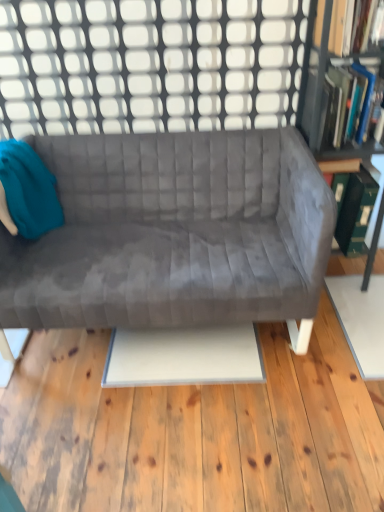
Question: Is the position of hardcover book at upper right, which is counted as the 2th book, starting from the bottom, more distant than that of hardcover book at upper right, which appears as the 1th book when ordered from the bottom?

Choices:
 (A) yes
 (B) no

Answer: (B)

Question: Is the depth of hardcover book at upper right, placed as the 1th book when sorted from top to bottom, less than that of hardcover book at upper right, which is the 2th book from top to bottom?

Choices:
 (A) yes
 (B) no

Answer: (A)

Question: Are hardcover book at upper right, placed as the 1th book when sorted from top to bottom, and hardcover book at upper right, which is the 2th book from top to bottom, located far from each other?

Choices:
 (A) no
 (B) yes

Answer: (A)

Question: From the image's perspective, is hardcover book at upper right, which is counted as the 2th book, starting from the bottom, above hardcover book at upper right, which appears as the 1th book when ordered from the bottom?

Choices:
 (A) yes
 (B) no

Answer: (A)

Question: Is hardcover book at upper right, placed as the 1th book when sorted from top to bottom, positioned with its back to hardcover book at upper right, which is the 2th book from top to bottom?

Choices:
 (A) no
 (B) yes

Answer: (A)

Question: In terms of height, does velvet gray couch at center look taller or shorter compared to green cardboard bookcase at right?

Choices:
 (A) short
 (B) tall

Answer: (A)

Question: Considering the positions of velvet gray couch at center and green cardboard bookcase at right in the image, is velvet gray couch at center bigger or smaller than green cardboard bookcase at right?

Choices:
 (A) big
 (B) small

Answer: (A)

Question: Would you say velvet gray couch at center is inside or outside green cardboard bookcase at right?

Choices:
 (A) inside
 (B) outside

Answer: (B)

Question: From the image's perspective, is velvet gray couch at center positioned above or below green cardboard bookcase at right?

Choices:
 (A) above
 (B) below

Answer: (B)

Question: Is white grid at upper center bigger or smaller than hardcover book at upper right, placed as the 1th book when sorted from top to bottom?

Choices:
 (A) big
 (B) small

Answer: (A)

Question: Visually, is white grid at upper center positioned to the left or to the right of hardcover book at upper right, placed as the 1th book when sorted from top to bottom?

Choices:
 (A) left
 (B) right

Answer: (A)

Question: In terms of height, does white grid at upper center look taller or shorter compared to hardcover book at upper right, placed as the 1th book when sorted from top to bottom?

Choices:
 (A) tall
 (B) short

Answer: (A)

Question: Considering the positions of white grid at upper center and hardcover book at upper right, placed as the 1th book when sorted from top to bottom, in the image, is white grid at upper center wider or thinner than hardcover book at upper right, placed as the 1th book when sorted from top to bottom,?

Choices:
 (A) thin
 (B) wide

Answer: (A)

Question: Relative to white grid at upper center, is green cardboard bookcase at right in front or behind?

Choices:
 (A) front
 (B) behind

Answer: (A)

Question: Considering the positions of green cardboard bookcase at right and white grid at upper center in the image, is green cardboard bookcase at right bigger or smaller than white grid at upper center?

Choices:
 (A) big
 (B) small

Answer: (A)